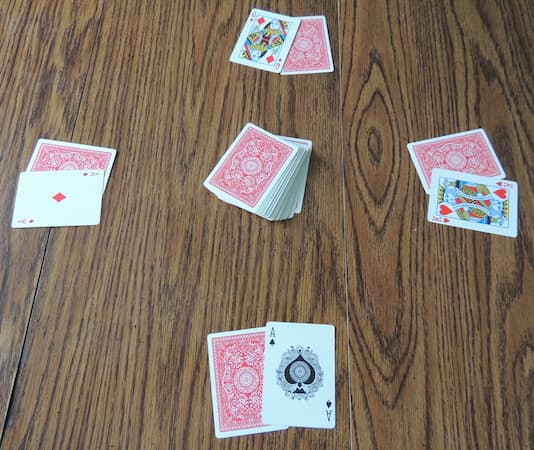
You are a GUI agent. You are given a task and a screenshot of the screen. Output one action in this format:
    pyautogui.click(x=<x>, y=<y>)
    Task: Click on the playing cards
    
    Given the screenshot: What is the action you would take?
    pyautogui.click(x=248, y=374), pyautogui.click(x=293, y=366), pyautogui.click(x=257, y=179), pyautogui.click(x=84, y=150), pyautogui.click(x=54, y=197), pyautogui.click(x=259, y=52), pyautogui.click(x=305, y=44), pyautogui.click(x=449, y=151), pyautogui.click(x=477, y=217), pyautogui.click(x=466, y=209)